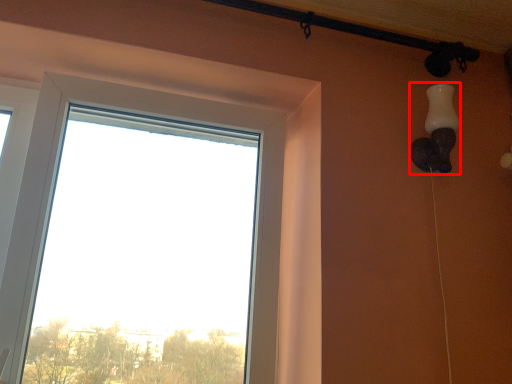
Question: In this image, where is lamp (annotated by the red box) located relative to window?

Choices:
 (A) left
 (B) right

Answer: (B)